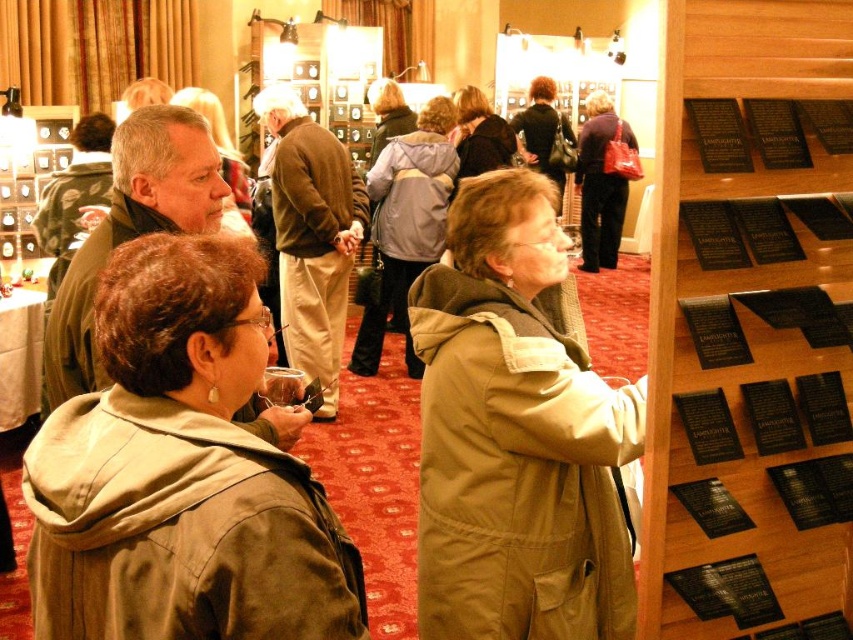
Question: Is tan fabric trench coat at center to the right of matte brown jacket at center from the viewer's perspective?

Choices:
 (A) no
 (B) yes

Answer: (B)

Question: Which point is farther to the camera?

Choices:
 (A) tan fabric trench coat at center
 (B) matte brown jacket at center

Answer: (A)

Question: Which object is closer to the camera taking this photo?

Choices:
 (A) tan fabric trench coat at center
 (B) brown leather jacket at center

Answer: (A)

Question: Is tan fabric trench coat at center wider than matte brown jacket at center?

Choices:
 (A) no
 (B) yes

Answer: (B)

Question: Which object appears closest to the camera in this image?

Choices:
 (A) tan fabric trench coat at center
 (B) brown leather jacket at center
 (C) matte brown jacket at center

Answer: (C)

Question: Is brown leather jacket at center smaller than matte brown jacket at center?

Choices:
 (A) no
 (B) yes

Answer: (A)